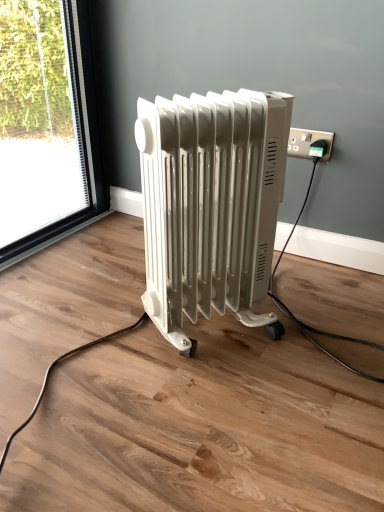
Question: Is green plastic plug at upper right further to the viewer compared to white glossy radiator at center?

Choices:
 (A) no
 (B) yes

Answer: (B)

Question: From the image's perspective, would you say green plastic plug at upper right is shown under white glossy radiator at center?

Choices:
 (A) yes
 (B) no

Answer: (B)

Question: From the image's perspective, is green plastic plug at upper right on white glossy radiator at center?

Choices:
 (A) no
 (B) yes

Answer: (B)

Question: Is green plastic plug at upper right taller than white glossy radiator at center?

Choices:
 (A) no
 (B) yes

Answer: (A)

Question: Is green plastic plug at upper right in contact with white glossy radiator at center?

Choices:
 (A) yes
 (B) no

Answer: (B)

Question: Is green plastic plug at upper right facing towards white glossy radiator at center?

Choices:
 (A) yes
 (B) no

Answer: (A)

Question: From the image's perspective, is white glossy radiator at center above green plastic plug at upper right?

Choices:
 (A) no
 (B) yes

Answer: (A)

Question: Is white glossy radiator at center positioned beyond the bounds of green plastic plug at upper right?

Choices:
 (A) yes
 (B) no

Answer: (A)

Question: From the image's perspective, would you say white glossy radiator at center is shown under green plastic plug at upper right?

Choices:
 (A) yes
 (B) no

Answer: (A)

Question: Does white glossy radiator at center have a lesser height compared to green plastic plug at upper right?

Choices:
 (A) no
 (B) yes

Answer: (A)

Question: Is green plastic plug at upper right a part of white glossy radiator at center?

Choices:
 (A) no
 (B) yes

Answer: (A)

Question: Is white glossy radiator at center wider than green plastic plug at upper right?

Choices:
 (A) yes
 (B) no

Answer: (A)

Question: Considering the positions of white glossy radiator at center and green plastic plug at upper right in the image, is white glossy radiator at center taller or shorter than green plastic plug at upper right?

Choices:
 (A) short
 (B) tall

Answer: (B)